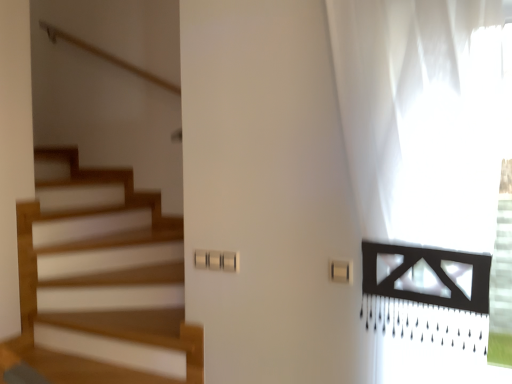
Question: Is white sheer curtain at right bigger or smaller than white plastic light switch at center?

Choices:
 (A) small
 (B) big

Answer: (B)

Question: From a real-world perspective, is white sheer curtain at right positioned above or below white plastic light switch at center?

Choices:
 (A) above
 (B) below

Answer: (A)

Question: Considering the positions of point click(x=388, y=148) and point click(x=337, y=276), is point click(x=388, y=148) closer or farther from the camera than point click(x=337, y=276)?

Choices:
 (A) farther
 (B) closer

Answer: (B)

Question: From the image's perspective, is white plastic light switch at center located above or below white sheer curtain at right?

Choices:
 (A) above
 (B) below

Answer: (B)

Question: Considering the positions of white plastic light switch at center and white sheer curtain at right in the image, is white plastic light switch at center wider or thinner than white sheer curtain at right?

Choices:
 (A) wide
 (B) thin

Answer: (B)

Question: Considering the positions of point (338, 279) and point (382, 147), is point (338, 279) closer or farther from the camera than point (382, 147)?

Choices:
 (A) farther
 (B) closer

Answer: (A)

Question: Considering the positions of white plastic light switch at center and white sheer curtain at right in the image, is white plastic light switch at center bigger or smaller than white sheer curtain at right?

Choices:
 (A) small
 (B) big

Answer: (A)